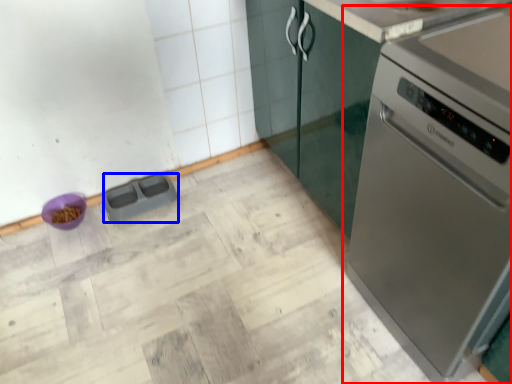
Question: Which object appears farthest to the camera in this image, home appliance (highlighted by a red box) or appliance (highlighted by a blue box)?

Choices:
 (A) home appliance
 (B) appliance

Answer: (B)